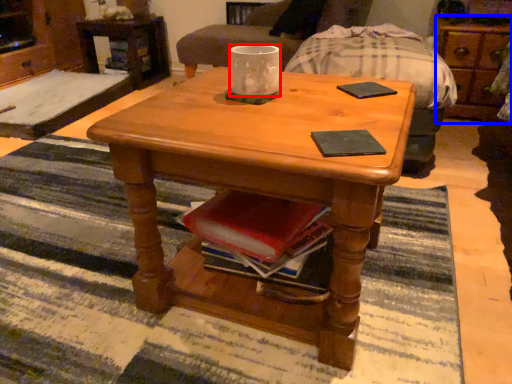
Question: Which object is further to the camera taking this photo, coffee cup (highlighted by a red box) or dresser (highlighted by a blue box)?

Choices:
 (A) coffee cup
 (B) dresser

Answer: (B)